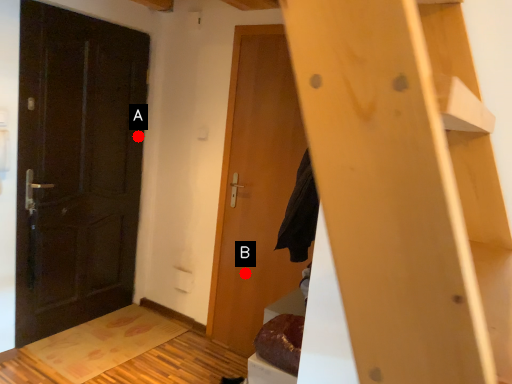
Question: Two points are circled on the image, labeled by A and B beside each circle. Among these points, which one is nearest to the camera?

Choices:
 (A) A is closer
 (B) B is closer

Answer: (B)